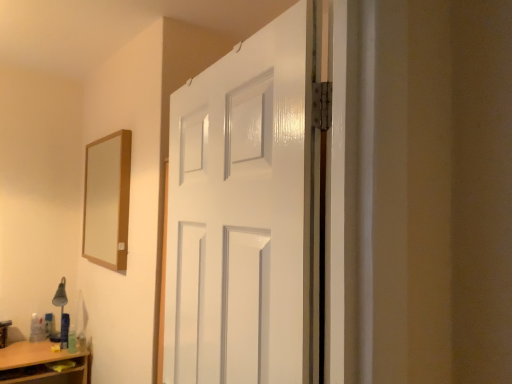
Question: From a real-world perspective, is white glossy door at center positioned over matte silver table lamp at lower left based on gravity?

Choices:
 (A) no
 (B) yes

Answer: (B)

Question: Is matte silver table lamp at lower left surrounded by white glossy door at center?

Choices:
 (A) yes
 (B) no

Answer: (B)

Question: Does white glossy door at center turn towards matte silver table lamp at lower left?

Choices:
 (A) yes
 (B) no

Answer: (B)

Question: Does white glossy door at center have a smaller size compared to matte silver table lamp at lower left?

Choices:
 (A) no
 (B) yes

Answer: (A)

Question: Is white glossy door at center closer to camera compared to matte silver table lamp at lower left?

Choices:
 (A) yes
 (B) no

Answer: (A)

Question: Would you say wooden-framed mirror at upper left is inside or outside white glossy door at center?

Choices:
 (A) outside
 (B) inside

Answer: (A)

Question: In terms of width, does wooden-framed mirror at upper left look wider or thinner when compared to white glossy door at center?

Choices:
 (A) thin
 (B) wide

Answer: (A)

Question: In terms of size, does wooden-framed mirror at upper left appear bigger or smaller than white glossy door at center?

Choices:
 (A) small
 (B) big

Answer: (A)

Question: From a real-world perspective, is wooden-framed mirror at upper left above or below white glossy door at center?

Choices:
 (A) above
 (B) below

Answer: (A)

Question: Considering their positions, is matte silver table lamp at lower left located in front of or behind wooden-framed mirror at upper left?

Choices:
 (A) front
 (B) behind

Answer: (B)

Question: In terms of width, does matte silver table lamp at lower left look wider or thinner when compared to wooden-framed mirror at upper left?

Choices:
 (A) thin
 (B) wide

Answer: (B)

Question: Is matte silver table lamp at lower left inside or outside of wooden-framed mirror at upper left?

Choices:
 (A) inside
 (B) outside

Answer: (B)

Question: From a real-world perspective, is matte silver table lamp at lower left above or below wooden-framed mirror at upper left?

Choices:
 (A) above
 (B) below

Answer: (B)

Question: From a real-world perspective, is white glossy door at center physically located above or below wooden-framed mirror at upper left?

Choices:
 (A) above
 (B) below

Answer: (B)

Question: Based on their sizes in the image, would you say white glossy door at center is bigger or smaller than wooden-framed mirror at upper left?

Choices:
 (A) small
 (B) big

Answer: (B)